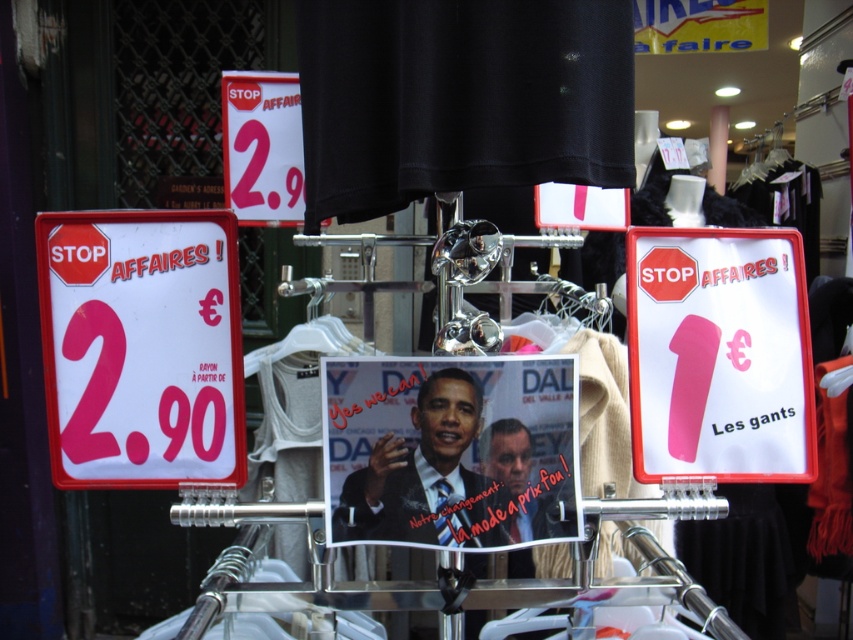
Can you confirm if pink paper sign at center is shorter than matte white sign at upper center?

In fact, pink paper sign at center may be taller than matte white sign at upper center.

Which is behind, point (631, 348) or point (293, 212)?

The point (293, 212) is more distant.

Does point (732, 307) come farther from viewer compared to point (299, 211)?

No, (732, 307) is in front of (299, 211).

Where is `pink paper sign at center`? pink paper sign at center is located at coordinates (718, 355).

Is white paper sign at left shorter than pink paper sign at center?

Incorrect, white paper sign at left's height does not fall short of pink paper sign at center's.

What do you see at coordinates (141, 348) in the screenshot? I see `white paper sign at left` at bounding box center [141, 348].

Describe the element at coordinates (141, 348) in the screenshot. Image resolution: width=853 pixels, height=640 pixels. I see `white paper sign at left` at that location.

At what (x,y) coordinates should I click in order to perform the action: click on white paper sign at left. Please return your answer as a coordinate pair (x, y). The image size is (853, 640). Looking at the image, I should click on (141, 348).

Which is above, white paper sign at left or matte white sign at upper center?

Positioned higher is matte white sign at upper center.

Who is shorter, white paper sign at left or matte white sign at upper center?

With less height is matte white sign at upper center.

Between point (236, 465) and point (234, 172), which one is positioned in front?

Point (236, 465)

The width and height of the screenshot is (853, 640). Identify the location of white paper sign at left. (141, 348).